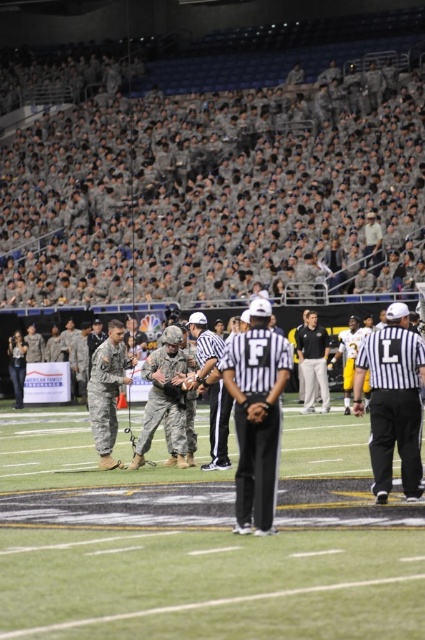
You are a photographer standing at the edge of the field. You want to take a photo that includes both the green turf at center and the black smooth shirt at center. Given that your camera has a maximum focus range of 5 meters, will you be able to capture both objects in focus?

The green turf at center and black smooth shirt at center are 4.90 meters apart from each other. Since the distance between them is within the camera maximum focus range of 5 meters, you can capture both objects in focus.